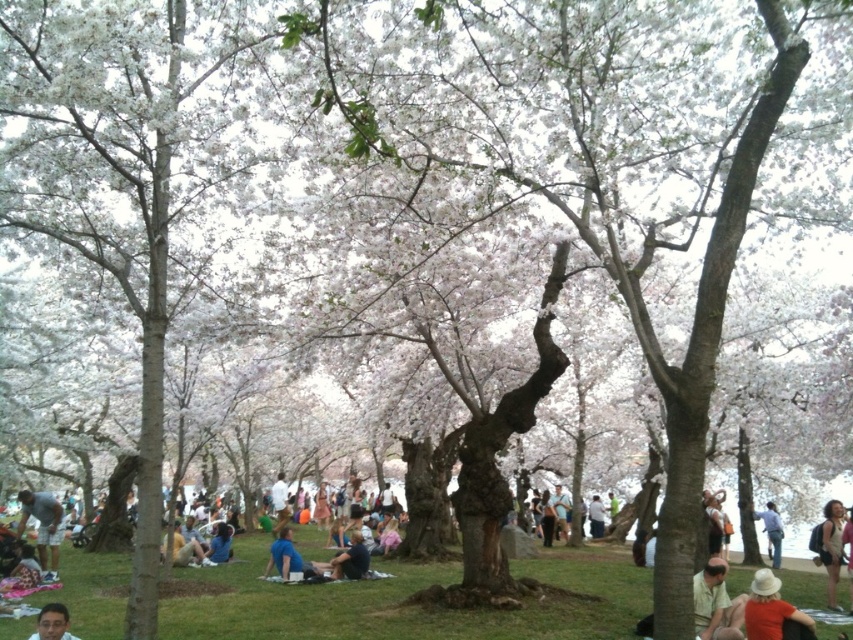
You are a photographer standing in the cherry blossom grove. You notice two pieces of clothing on the ground near you. The light blue denim shorts at lower left and the blue jeans at lower right. Which clothing item is positioned higher up in the scene?

The light blue denim shorts at lower left is taller than blue jeans at lower right, so the light blue denim shorts at lower left is positioned higher up in the scene.

You are standing at the origin point in the cherry blossom grove. You see two points marked in the scene. Which point is closer to you, point (724, 568) or point (751, 609)?

Point (751, 609) is closer to you because point (724, 568) is behind it.

You are standing in the cherry blossom grove and want to take a photo. There are two points of interest marked in the scene. The first is at coordinates point (334, 563) and the second at point (776, 544). Which point is closer to your current position?

Point (334, 563) is closer to the camera than point (776, 544), so the first point is closer to your current position.